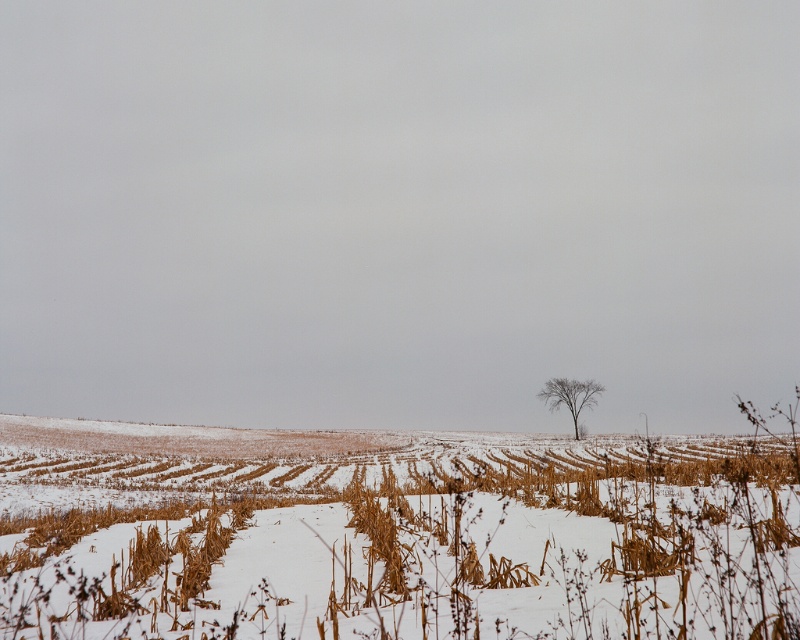
Question: Which object is closer to the camera taking this photo?

Choices:
 (A) brown grass at center
 (B) bare branches at center

Answer: (A)

Question: Is brown grass at center positioned at the back of bare branches at center?

Choices:
 (A) yes
 (B) no

Answer: (B)

Question: Which point is farther from the camera taking this photo?

Choices:
 (A) (58, 566)
 (B) (545, 397)

Answer: (B)

Question: Does brown grass at center appear under bare branches at center?

Choices:
 (A) no
 (B) yes

Answer: (A)

Question: Is brown grass at center to the right of bare branches at center from the viewer's perspective?

Choices:
 (A) no
 (B) yes

Answer: (A)

Question: Which point appears closest to the camera in this image?

Choices:
 (A) (0, 426)
 (B) (588, 381)

Answer: (A)